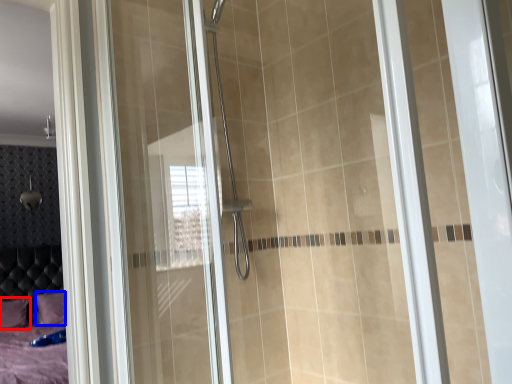
Question: Which object is closer to the camera taking this photo, pillow (highlighted by a red box) or pillow (highlighted by a blue box)?

Choices:
 (A) pillow
 (B) pillow

Answer: (B)